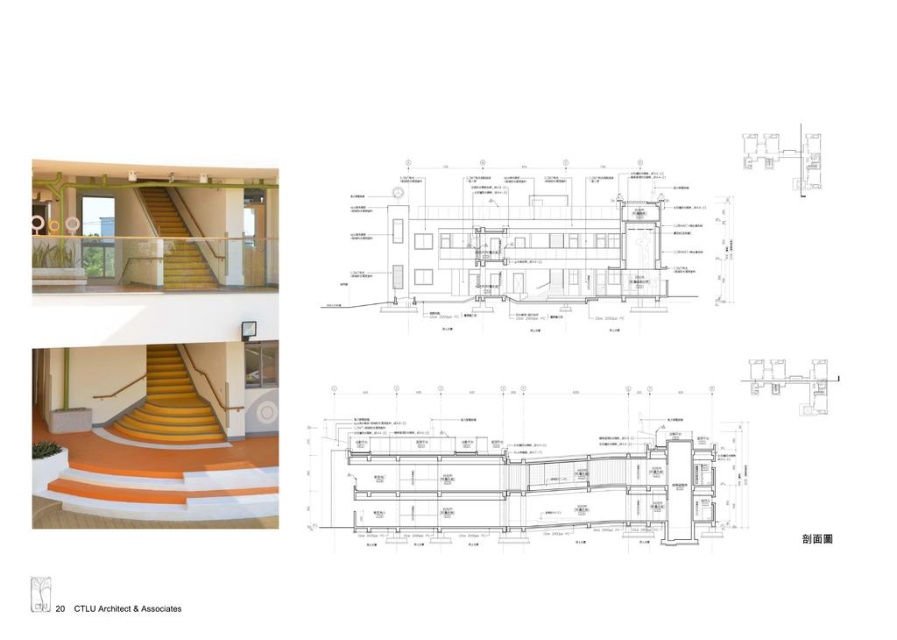
Who is positioned more to the right, orange carpeted stairs at center or yellow matte/stained wood stairs at upper center?

yellow matte/stained wood stairs at upper center is more to the right.

Between point (150, 397) and point (185, 248), which one is positioned in front?

Point (185, 248) is in front.

At what (x,y) coordinates should I click in order to perform the action: click on orange carpeted stairs at center. Please return your answer as a coordinate pair (x, y). Looking at the image, I should click on (168, 404).